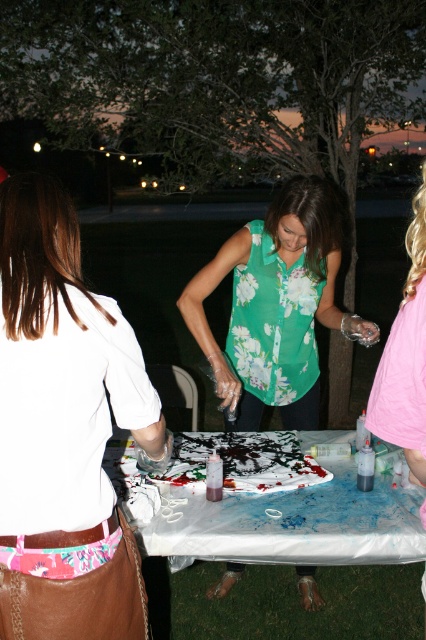
Question: Among these points, which one is nearest to the camera?

Choices:
 (A) (423, 220)
 (B) (385, 502)
 (C) (245, 422)

Answer: (A)

Question: Is white leather purse at lower left above floral green blouse at center?

Choices:
 (A) yes
 (B) no

Answer: (B)

Question: Does white leather purse at lower left have a greater width compared to floral green blouse at center?

Choices:
 (A) no
 (B) yes

Answer: (A)

Question: Which point is closer to the camera?

Choices:
 (A) white plastic picnic table at center
 (B) floral green blouse at center

Answer: (A)

Question: Can you confirm if white leather purse at lower left is thinner than white plastic picnic table at center?

Choices:
 (A) yes
 (B) no

Answer: (A)

Question: Estimate the real-world distances between objects in this image. Which object is farther from the white leather purse at lower left?

Choices:
 (A) white plastic picnic table at center
 (B) floral green blouse at center

Answer: (B)